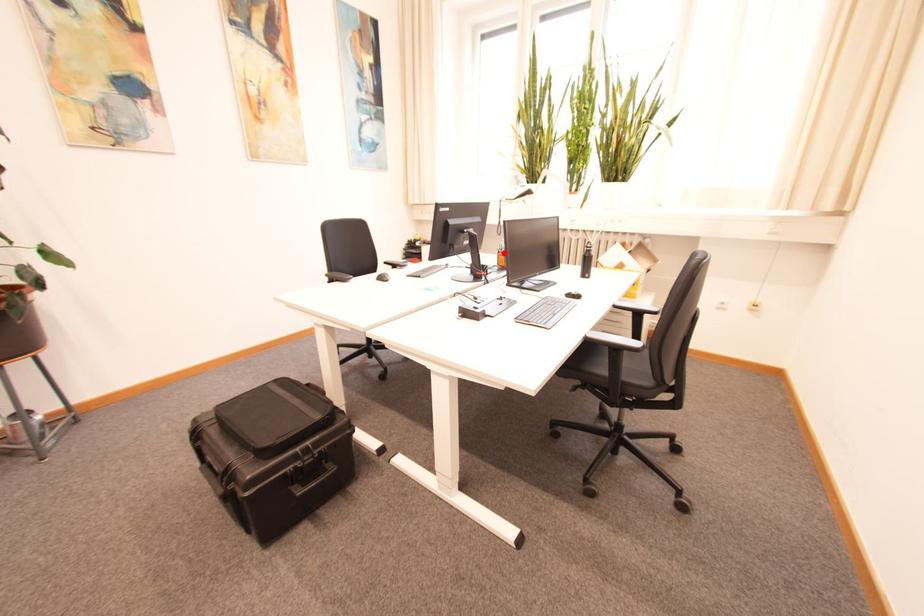
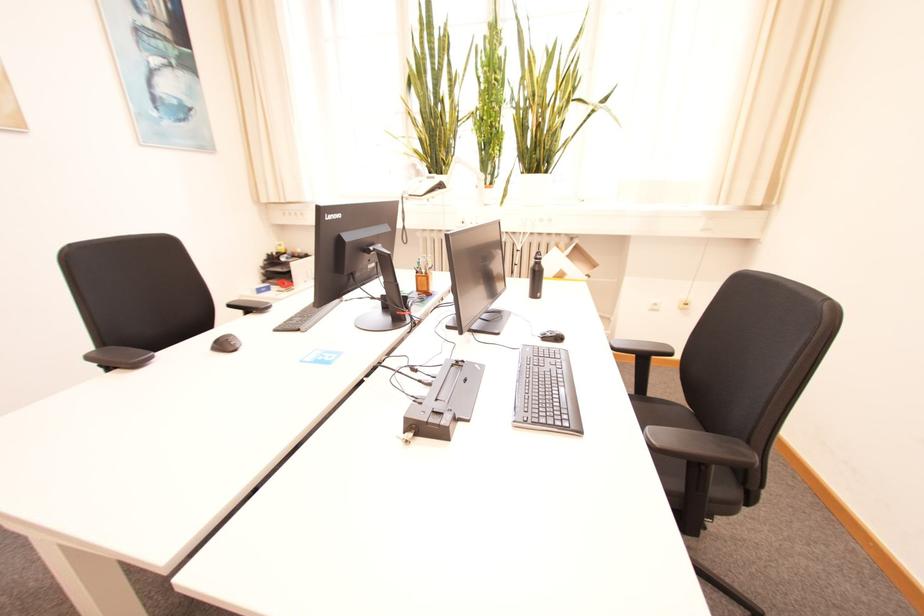
Find the pixel in the second image that matches the highlighted location in the first image.

(421, 273)